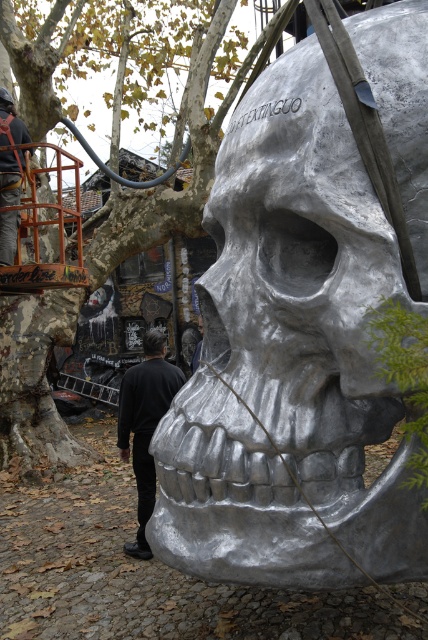
You are an art installer setting up coordinates for a new exhibit. The shiny silver skull at center is placed at point 0.561 on the x axis and 0.675 on the y axis. If you need to position a spotlight exactly 0.1 units to the right of the skull, what would be the new x coordinate for the spotlight?

The new x coordinate for the spotlight would be 0.561 plus 0.1, which equals 0.661. So the spotlight should be placed at x coordinate 0.661.

Looking at this image, you are standing in front of the metallic sculpture and want to move from point A to point B. If point A is at coordinate point(53, 336) and point B is at coordinate point(121, 452), which point is closer to you when you are facing the sculpture?

Point A at coordinate point(53, 336) is closer to you because it is further to the camera than point B at coordinate point(121, 452).

You are an art critic standing in front of the sculpture. You notice the shiny silver skull at center and the smooth bark tree at center. Which object is positioned closer to you?

The shiny silver skull at center is closer to the viewer than the smooth bark tree at center.